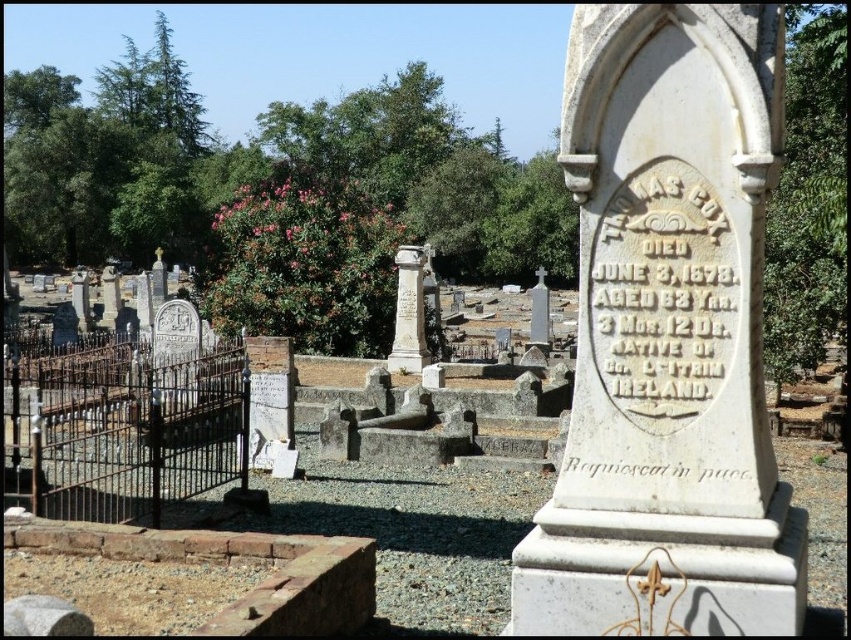
The width and height of the screenshot is (851, 640). What do you see at coordinates (667, 337) in the screenshot?
I see `white stone monument at center` at bounding box center [667, 337].

Is white stone monument at center wider than white stone cross at center?

No, white stone monument at center is not wider than white stone cross at center.

Is point (692, 616) behind point (546, 330)?

No.

Find the location of a particular element. white stone monument at center is located at coordinates (667, 337).

What are the coordinates of `white stone gravestone at center` in the screenshot? It's located at (420, 499).

The image size is (851, 640). I want to click on white stone gravestone at center, so click(x=420, y=499).

Is white marble column at center bigger than white stone cross at center?

No.

The height and width of the screenshot is (640, 851). What do you see at coordinates (410, 310) in the screenshot?
I see `white marble column at center` at bounding box center [410, 310].

Locate an element on the screen. The image size is (851, 640). white marble column at center is located at coordinates (410, 310).